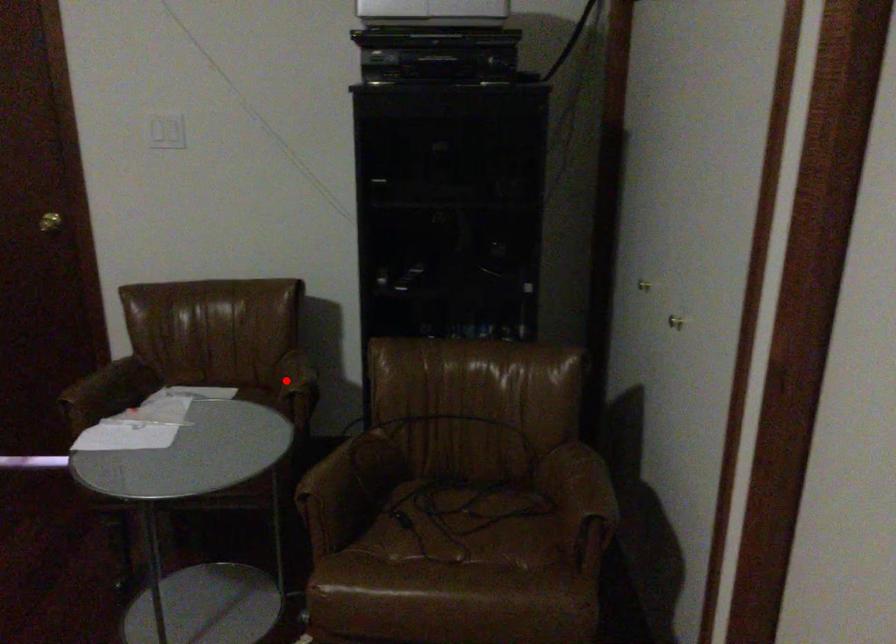
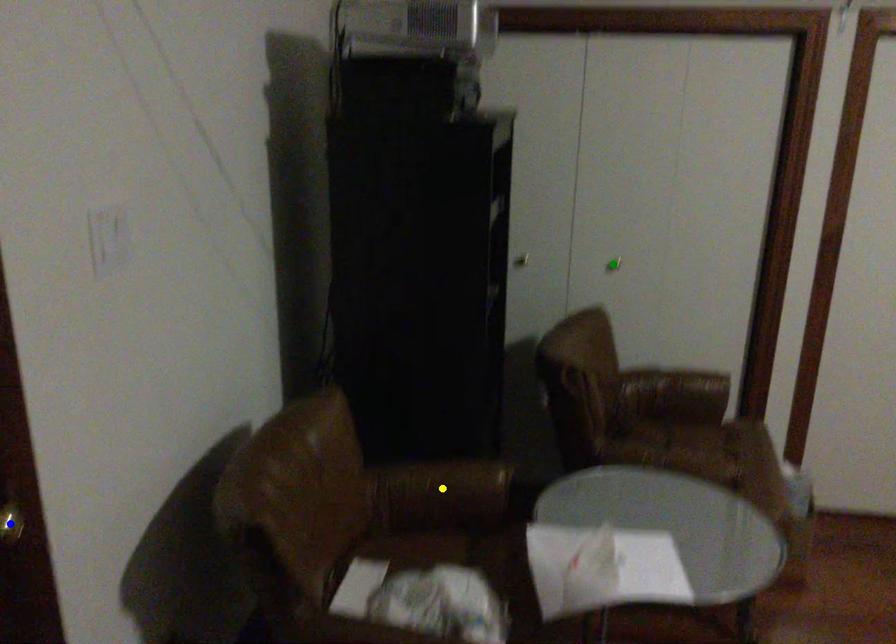
Question: I am providing you with two images of the same scene from different viewpoints. A red point is marked on the first image. You are given multiple points on the second image. Which mark in image 2 goes with the point in image 1?

Choices:
 (A) green point
 (B) blue point
 (C) yellow point

Answer: (C)